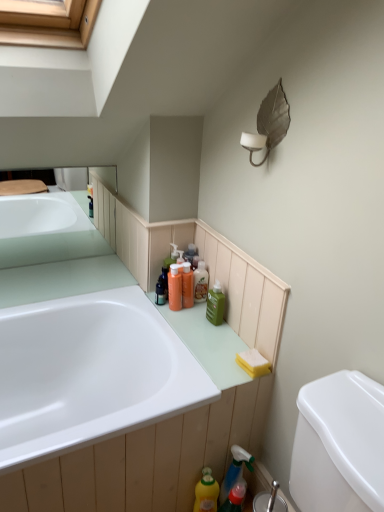
Image resolution: width=384 pixels, height=512 pixels. What are the coordinates of `vacant space that's between orange plastic bottles at center, which is the first toiletry from left to right, and green matte bottle at upper right, the third cleaning product ordered from the bottom` in the screenshot? It's located at (199, 313).